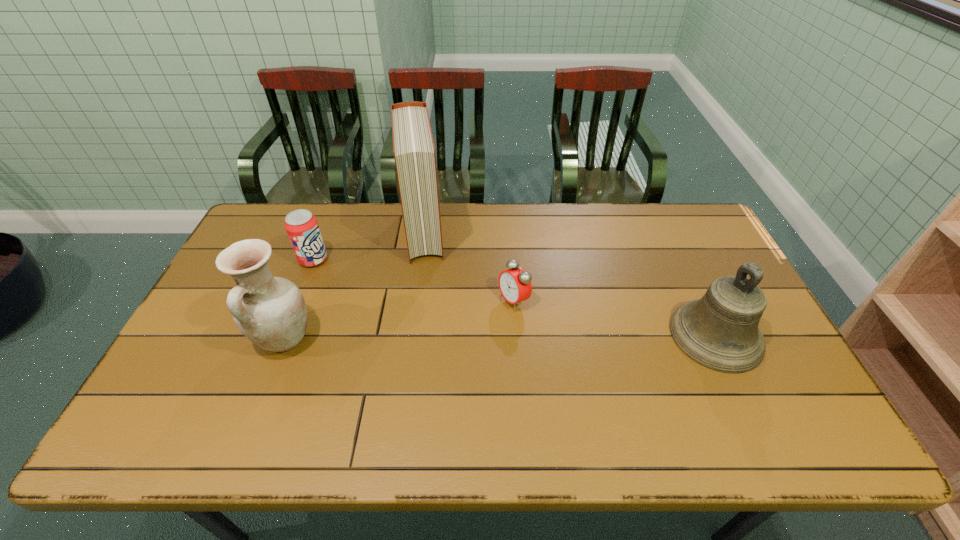
Locate an element on the screen. The image size is (960, 540). vacant space on the desktop that is between the pottery and the rightmost object and is positioned on the surface of the soda can is located at coordinates (438, 338).

Where is `free space on the desktop that is between the pottery and the bell and is positioned on the front-facing side of the shortest object`? The image size is (960, 540). free space on the desktop that is between the pottery and the bell and is positioned on the front-facing side of the shortest object is located at coordinates (438, 338).

Locate an element on the screen. This screenshot has width=960, height=540. free spot on the desktop that is between the pottery and the bell and is positioned on the open cover of the third object from right to left is located at coordinates (437, 338).